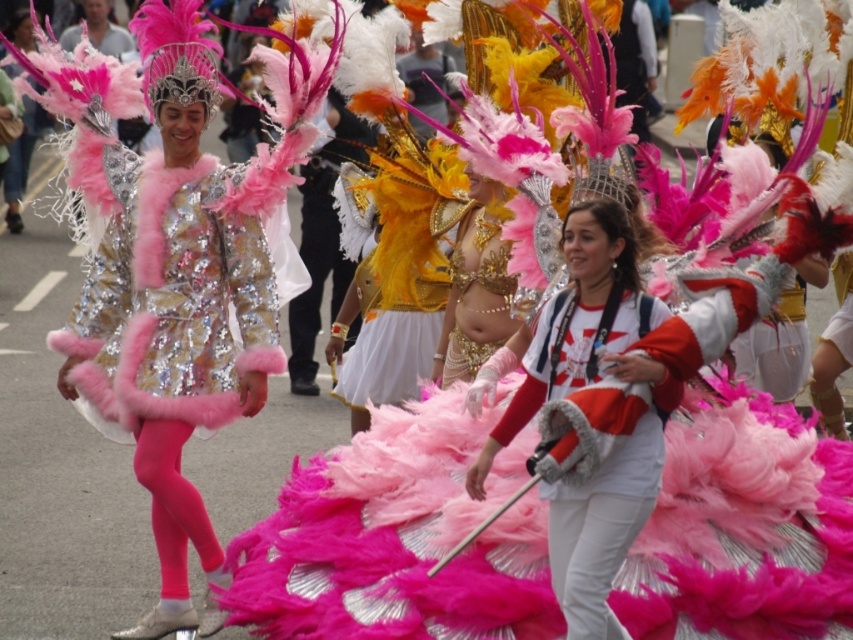
Question: Does matte silver helmet at upper center appear under white cotton scarf at center?

Choices:
 (A) no
 (B) yes

Answer: (A)

Question: Among these points, which one is farthest from the camera?

Choices:
 (A) (x=148, y=67)
 (B) (x=592, y=465)

Answer: (A)

Question: Can you confirm if matte silver helmet at upper center is smaller than white cotton scarf at center?

Choices:
 (A) no
 (B) yes

Answer: (B)

Question: Where is matte silver helmet at upper center located in relation to white cotton scarf at center in the image?

Choices:
 (A) below
 (B) above

Answer: (B)

Question: Among these points, which one is farthest from the camera?

Choices:
 (A) (605, 582)
 (B) (216, 371)

Answer: (B)